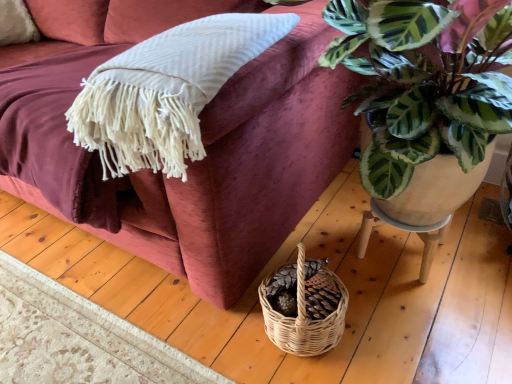
The width and height of the screenshot is (512, 384). What do you see at coordinates (408, 231) in the screenshot?
I see `wooden stool at lower right` at bounding box center [408, 231].

Locate an element on the screen. The image size is (512, 384). wooden stool at lower right is located at coordinates (408, 231).

This screenshot has height=384, width=512. What do you see at coordinates (195, 161) in the screenshot?
I see `velvet maroon couch at upper left` at bounding box center [195, 161].

Identify the location of velvet maroon couch at upper left. (195, 161).

The image size is (512, 384). Identify the location of wooden stool at lower right. (408, 231).

From the picture: Considering the relative positions of wooden stool at lower right and velvet maroon couch at upper left in the image provided, is wooden stool at lower right to the right of velvet maroon couch at upper left from the viewer's perspective?

Yes, wooden stool at lower right is to the right of velvet maroon couch at upper left.

In the image, is wooden stool at lower right positioned in front of or behind velvet maroon couch at upper left?

In the image, wooden stool at lower right appears behind velvet maroon couch at upper left.

Which is less distant, (448,221) or (289,80)?

Point (448,221) appears to be farther away from the viewer than point (289,80).

From the image's perspective, which is below, wooden stool at lower right or velvet maroon couch at upper left?

wooden stool at lower right, from the image's perspective.

From the picture: From a real-world perspective, who is located higher, wooden stool at lower right or velvet maroon couch at upper left?

velvet maroon couch at upper left.

Considering the relative sizes of wooden stool at lower right and velvet maroon couch at upper left in the image provided, is wooden stool at lower right wider than velvet maroon couch at upper left?

In fact, wooden stool at lower right might be narrower than velvet maroon couch at upper left.

Consider the image. Which of these two, wooden stool at lower right or velvet maroon couch at upper left, stands shorter?

Answer: With less height is wooden stool at lower right.

Consider the image. Considering the sizes of objects wooden stool at lower right and velvet maroon couch at upper left in the image provided, who is smaller, wooden stool at lower right or velvet maroon couch at upper left?

wooden stool at lower right is smaller.

Is wooden stool at lower right inside or outside of velvet maroon couch at upper left?

wooden stool at lower right is spatially situated outside velvet maroon couch at upper left.

Based on the photo, are wooden stool at lower right and velvet maroon couch at upper left beside each other?

No, wooden stool at lower right is not beside velvet maroon couch at upper left.

Is wooden stool at lower right aimed at velvet maroon couch at upper left?

No, wooden stool at lower right is not aimed at velvet maroon couch at upper left.

How many degrees apart are the facing directions of wooden stool at lower right and velvet maroon couch at upper left?

The angular difference between wooden stool at lower right and velvet maroon couch at upper left is 1.13 degrees.

Locate an element on the screen. studio couch located on the left of wooden stool at lower right is located at coordinates (195, 161).

Can you confirm if velvet maroon couch at upper left is positioned to the left of wooden stool at lower right?

Correct, you'll find velvet maroon couch at upper left to the left of wooden stool at lower right.

Is velvet maroon couch at upper left in front of or behind wooden stool at lower right in the image?

In the image, velvet maroon couch at upper left appears in front of wooden stool at lower right.

Does point (92, 188) come in front of point (432, 245)?

Yes, point (92, 188) is in front of point (432, 245).

From the image's perspective, is velvet maroon couch at upper left on top of wooden stool at lower right?

Yes, from the image's perspective, velvet maroon couch at upper left is above wooden stool at lower right.

From a real-world perspective, who is located lower, velvet maroon couch at upper left or wooden stool at lower right?

wooden stool at lower right.

Between velvet maroon couch at upper left and wooden stool at lower right, which one has larger width?

With larger width is velvet maroon couch at upper left.

Who is taller, velvet maroon couch at upper left or wooden stool at lower right?

With more height is velvet maroon couch at upper left.

Can you confirm if velvet maroon couch at upper left is smaller than wooden stool at lower right?

Incorrect, velvet maroon couch at upper left is not smaller in size than wooden stool at lower right.

Is wooden stool at lower right inside velvet maroon couch at upper left?

No, wooden stool at lower right is not a part of velvet maroon couch at upper left.

Is velvet maroon couch at upper left next to wooden stool at lower right?

velvet maroon couch at upper left and wooden stool at lower right are clearly separated.

Looking at this image, is velvet maroon couch at upper left oriented towards wooden stool at lower right?

No, velvet maroon couch at upper left is not aimed at wooden stool at lower right.

What's the angular difference between velvet maroon couch at upper left and wooden stool at lower right's facing directions?

The angular difference between velvet maroon couch at upper left and wooden stool at lower right is 1.13 degrees.

You are a GUI agent. You are given a task and a screenshot of the screen. Output one action in this format:
    pyautogui.click(x=<x>, y=<y>)
    Task: Click on the table behind the velvet maroon couch at upper left
    This screenshot has height=384, width=512.
    Given the screenshot: What is the action you would take?
    pyautogui.click(x=408, y=231)

Image resolution: width=512 pixels, height=384 pixels. Find the location of `table on the right of velvet maroon couch at upper left`. table on the right of velvet maroon couch at upper left is located at coordinates (408, 231).

The height and width of the screenshot is (384, 512). In order to click on table below the velvet maroon couch at upper left (from the image's perspective) in this screenshot , I will do 408,231.